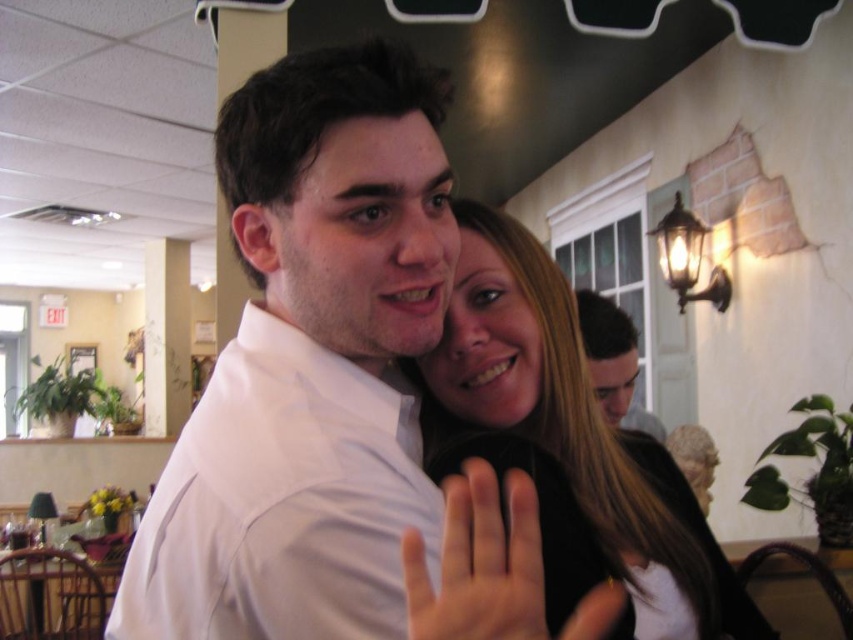
You are a photographer trying to capture the couple in the center of the image. You notice a point at coordinates (x=567, y=445). What is located at this point?

The point at coordinates (x=567, y=445) has smooth black hair at center.

You are a photographer trying to capture a closeup of the white smooth shirt at center and the smooth black hair at center. Since you want to ensure both are in focus, you need to know which one is wider. Which object has a greater width?

The white smooth shirt at center has a greater width than the smooth black hair at center according to the description.

You are a photographer standing at the entrance of the restaurant. You want to take a photo of the white smooth shirt at center without including the wall with faux brick design behind it. Is the shirt positioned in a way that allows this?

The white smooth shirt at center is located at point (329, 388), which means it is positioned away from the wall with faux brick design, so yes, the photographer can take the photo without including the wall.